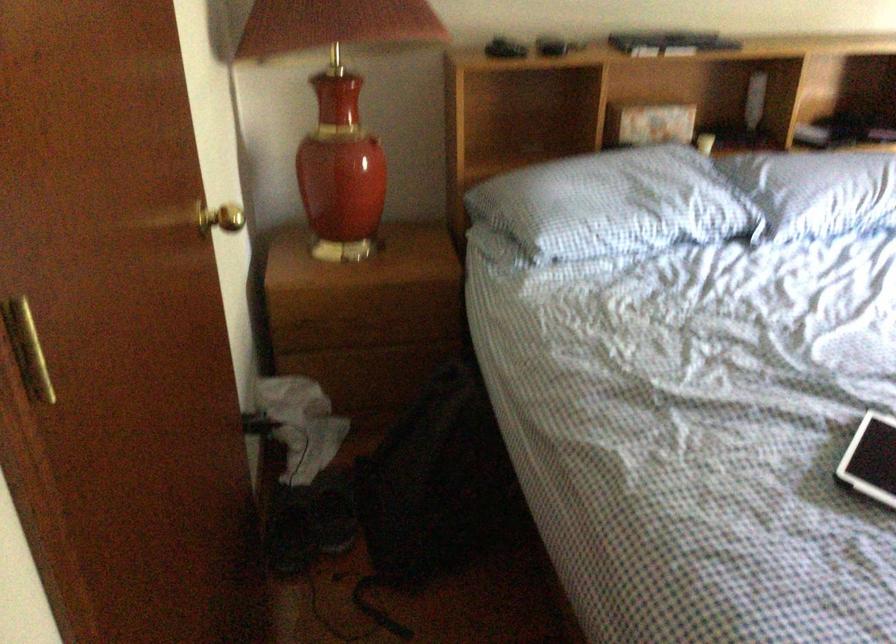
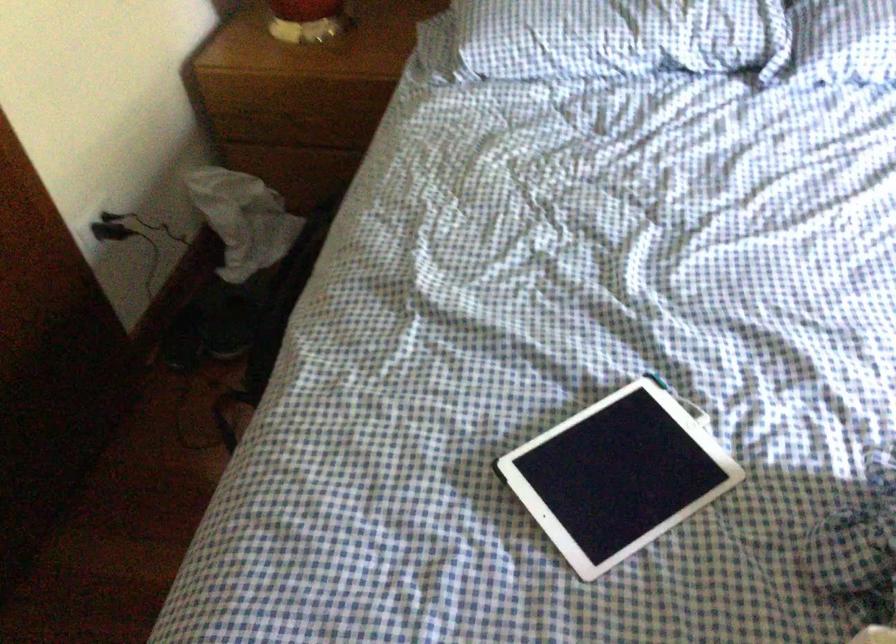
First-person continuous shooting, in which direction is the camera rotating?

The rotation direction of the camera is left-down.